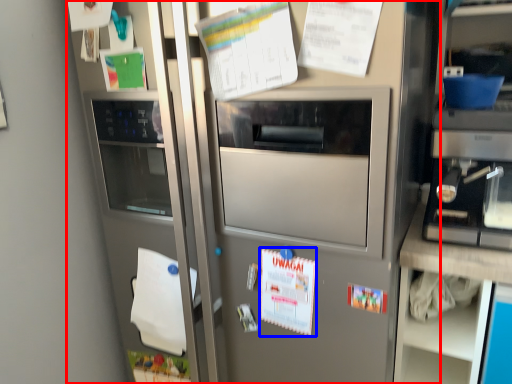
Question: Which object is further to the camera taking this photo, fridge (highlighted by a red box) or poster (highlighted by a blue box)?

Choices:
 (A) fridge
 (B) poster

Answer: (B)